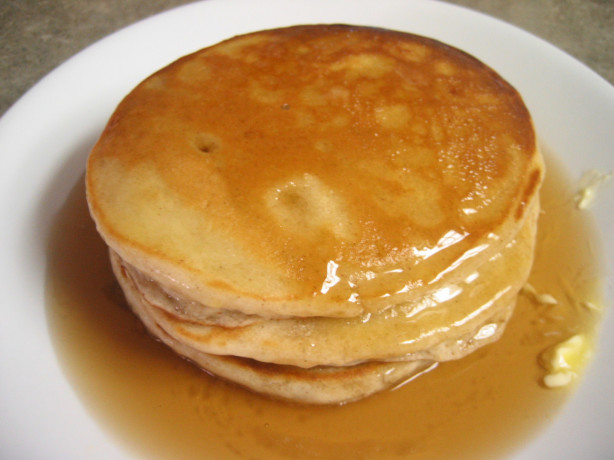
The image size is (614, 460). Identify the location of white plate. (48, 157).